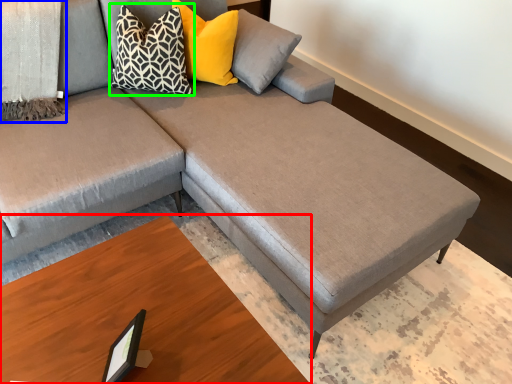
Question: Which object is the closest to the table (highlighted by a red box)? Choose among these: blanket (highlighted by a blue box) or pillow (highlighted by a green box).

Choices:
 (A) blanket
 (B) pillow

Answer: (B)